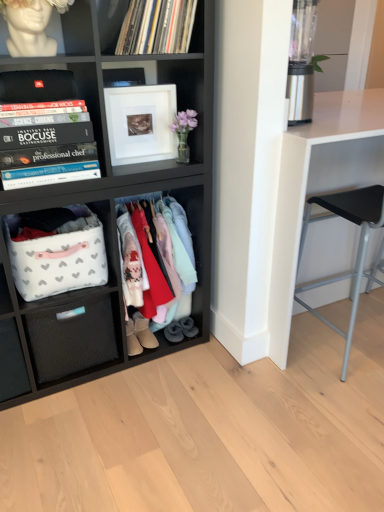
I want to click on vacant area located to the right-hand side of gray suede boot at lower center, which is the first footwear in right-to-left order, so click(x=208, y=334).